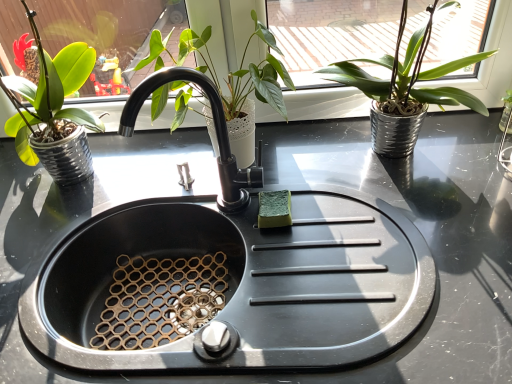
Question: Is green matte plant at center, arranged as the second houseplant when viewed from the right, with black matte faucet at center?

Choices:
 (A) no
 (B) yes

Answer: (A)

Question: Can you confirm if green matte plant at center, the 2th houseplant positioned from the left, is wider than black matte faucet at center?

Choices:
 (A) no
 (B) yes

Answer: (B)

Question: From the image's perspective, is green matte plant at center, arranged as the second houseplant when viewed from the right, beneath black matte faucet at center?

Choices:
 (A) yes
 (B) no

Answer: (B)

Question: Is green matte plant at center, arranged as the second houseplant when viewed from the right, to the left of black matte faucet at center from the viewer's perspective?

Choices:
 (A) yes
 (B) no

Answer: (B)

Question: Is green matte plant at center, arranged as the second houseplant when viewed from the right, far from black matte faucet at center?

Choices:
 (A) yes
 (B) no

Answer: (B)

Question: Is green matte plant at center, arranged as the second houseplant when viewed from the right, shorter than black matte faucet at center?

Choices:
 (A) no
 (B) yes

Answer: (A)

Question: From a real-world perspective, is black matte sink at center located higher than black matte faucet at center?

Choices:
 (A) no
 (B) yes

Answer: (A)

Question: From a real-world perspective, is black matte sink at center beneath black matte faucet at center?

Choices:
 (A) yes
 (B) no

Answer: (A)

Question: Does black matte sink at center have a lesser height compared to black matte faucet at center?

Choices:
 (A) no
 (B) yes

Answer: (A)

Question: Considering the relative positions of black matte sink at center and black matte faucet at center in the image provided, is black matte sink at center in front of black matte faucet at center?

Choices:
 (A) no
 (B) yes

Answer: (B)

Question: Could you tell me if black matte sink at center is facing black matte faucet at center?

Choices:
 (A) no
 (B) yes

Answer: (A)

Question: Are black matte sink at center and black matte faucet at center far apart?

Choices:
 (A) no
 (B) yes

Answer: (A)

Question: From a real-world perspective, is green matte plant at center, arranged as the second houseplant when viewed from the right, positioned over green matte plant pot at left, placed as the 3th houseplant when sorted from right to left, based on gravity?

Choices:
 (A) yes
 (B) no

Answer: (B)